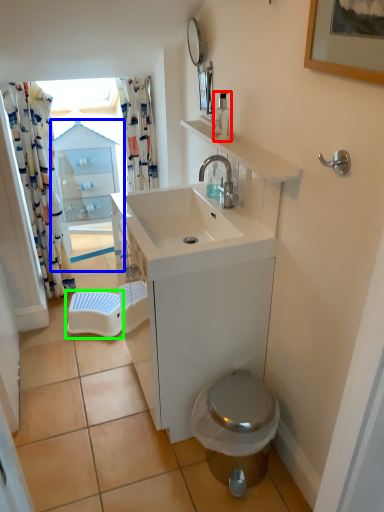
Question: Estimate the real-world distances between objects in this image. Which object is farther from soap dispenser (highlighted by a red box), glass door (highlighted by a blue box) or step stool (highlighted by a green box)?

Choices:
 (A) glass door
 (B) step stool

Answer: (A)